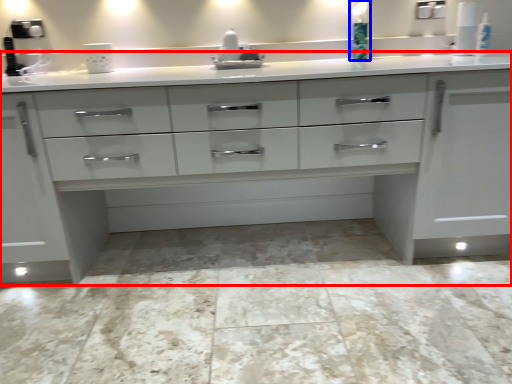
Question: Which object is closer to the camera taking this photo, chest of drawers (highlighted by a red box) or soap dispenser (highlighted by a blue box)?

Choices:
 (A) chest of drawers
 (B) soap dispenser

Answer: (A)